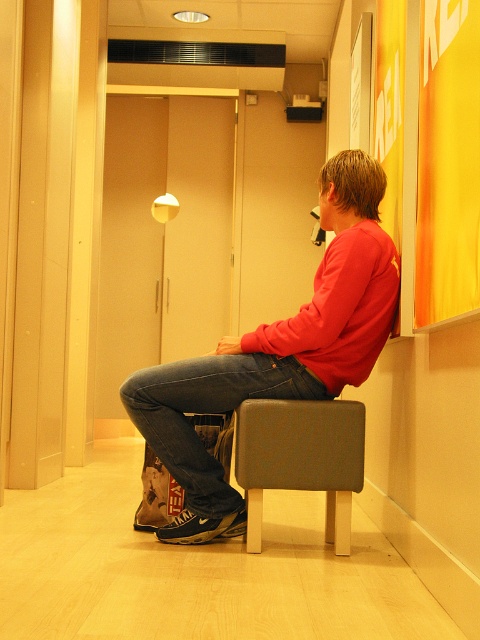
Question: Which object appears farthest from the camera in this image?

Choices:
 (A) red matte sweater at center
 (B) leather-like gray stool at center

Answer: (B)

Question: Which of the following is the farthest from the observer?

Choices:
 (A) (288, 435)
 (B) (197, 440)
 (C) (152, 433)

Answer: (B)

Question: Can you confirm if red matte sweater at center is positioned above denim at center?

Choices:
 (A) no
 (B) yes

Answer: (B)

Question: From the image, what is the correct spatial relationship of red matte sweater at center in relation to leather-like gray stool at center?

Choices:
 (A) below
 (B) above

Answer: (B)

Question: Is red matte sweater at center in front of leather-like gray stool at center?

Choices:
 (A) no
 (B) yes

Answer: (B)

Question: Which object is closer to the camera taking this photo?

Choices:
 (A) red matte sweater at center
 (B) leather-like gray stool at center

Answer: (A)